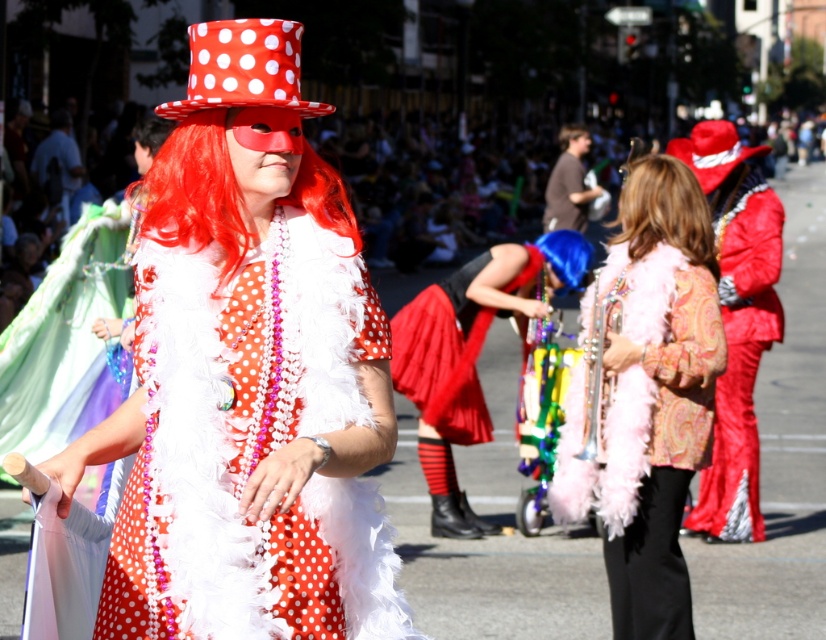
You are a photographer at the festival and want to capture both the red feather boa at center and the red synthetic wig at left in a single shot. Which object should you focus on first to ensure both are in frame?

The red feather boa at center is smaller than the red synthetic wig at left, so you should focus on the red synthetic wig at left first to ensure both are in frame.

You are a photographer trying to capture the perfect shot of the red feather boa at center. According to the coordinates provided, where exactly should you aim your camera to ensure the boa is in the frame?

The red feather boa at center is located at coordinates point (196, 192), so aim your camera at that exact point to capture it in the frame.

You are a photographer trying to capture the perfect shot of the red polka dot fabric hat at upper center and the brown curly hair at center. Based on their positions, which object is located below the other?

The red polka dot fabric hat at upper center is positioned under the brown curly hair at center, meaning the hat is below the hair.